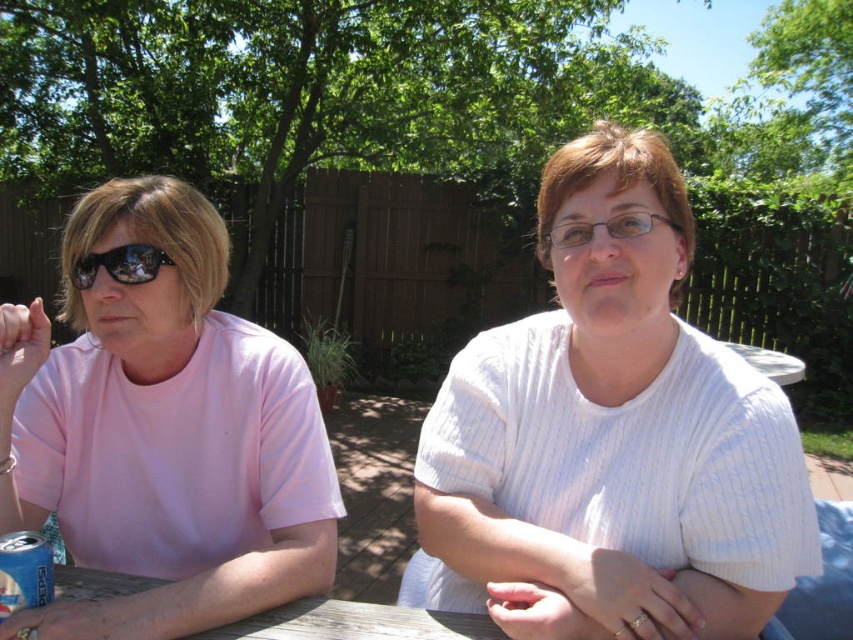
Question: Does wooden table at center appear over clear plastic glasses at center?

Choices:
 (A) no
 (B) yes

Answer: (A)

Question: Is white ribbed shirt at center wider than matte black sunglasses at left?

Choices:
 (A) no
 (B) yes

Answer: (B)

Question: In this image, where is white ribbed shirt at center located relative to pink matte shirt at left?

Choices:
 (A) above
 (B) below

Answer: (B)

Question: Among these objects, which one is nearest to the camera?

Choices:
 (A) pink matte shirt at left
 (B) matte black sunglasses at left

Answer: (A)

Question: Based on their relative distances, which object is nearer to the blue metallic can at lower left?

Choices:
 (A) clear plastic glasses at center
 (B) white ribbed shirt at center
 (C) wooden table at center

Answer: (C)

Question: Which object is closer to the camera taking this photo?

Choices:
 (A) matte black sunglasses at left
 (B) pink matte shirt at left
 (C) white ribbed shirt at center

Answer: (C)